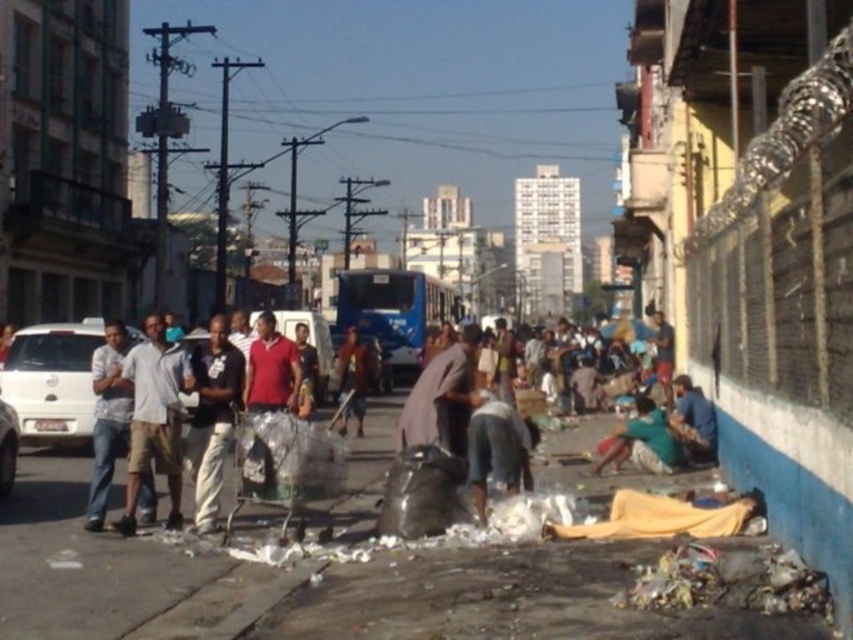
Is dark gray pants at center thinner than reddish-brown fabric pants at center?

In fact, dark gray pants at center might be wider than reddish-brown fabric pants at center.

Looking at this image, which is above, dark gray pants at center or reddish-brown fabric pants at center?

dark gray pants at center is above.

Does point (216, 326) lie in front of point (346, 422)?

Yes, point (216, 326) is in front of point (346, 422).

The image size is (853, 640). I want to click on dark gray pants at center, so click(212, 417).

Can you confirm if dark gray pants at center is wider than light blue denim jeans at left?

Yes.

Is dark gray pants at center shorter than light blue denim jeans at left?

No.

Between point (201, 440) and point (102, 371), which one is positioned in front?

Point (201, 440) is more forward.

I want to click on dark gray pants at center, so click(x=212, y=417).

Is point (207, 365) behind point (595, 468)?

No.

Is dark gray pants at center above green fabric shirt at lower right?

Correct, dark gray pants at center is located above green fabric shirt at lower right.

At what (x,y) coordinates should I click in order to perform the action: click on dark gray pants at center. Please return your answer as a coordinate pair (x, y). Looking at the image, I should click on coord(212,417).

At what (x,y) coordinates should I click in order to perform the action: click on dark gray pants at center. Please return your answer as a coordinate pair (x, y). The width and height of the screenshot is (853, 640). Looking at the image, I should click on (212, 417).